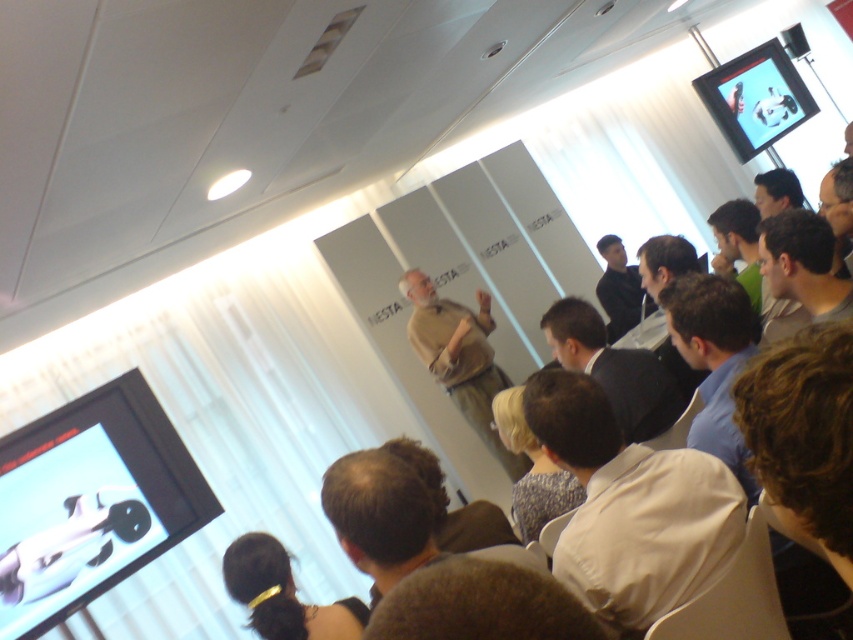
Does dark suit jacket at center have a smaller size compared to dark brown leather jacket at upper right?

Indeed, dark suit jacket at center has a smaller size compared to dark brown leather jacket at upper right.

Which is in front, point (553, 317) or point (618, 337)?

Point (553, 317) is in front.

Locate an element on the screen. The height and width of the screenshot is (640, 853). dark suit jacket at center is located at coordinates (613, 369).

Is matte black screen at lower left to the right of white cotton shirt at lower center from the viewer's perspective?

No, matte black screen at lower left is not to the right of white cotton shirt at lower center.

Where is `matte black screen at lower left`? matte black screen at lower left is located at coordinates (90, 500).

Describe the element at coordinates (90, 500) in the screenshot. The width and height of the screenshot is (853, 640). I see `matte black screen at lower left` at that location.

Locate an element on the screen. The image size is (853, 640). matte black screen at lower left is located at coordinates (90, 500).

Who is more distant from viewer, (708, 556) or (772, 115)?

The point (772, 115) is more distant.

Does white cotton shirt at lower center appear on the left side of matte black screen at upper right?

Correct, you'll find white cotton shirt at lower center to the left of matte black screen at upper right.

Identify the location of white cotton shirt at lower center. Image resolution: width=853 pixels, height=640 pixels. (631, 508).